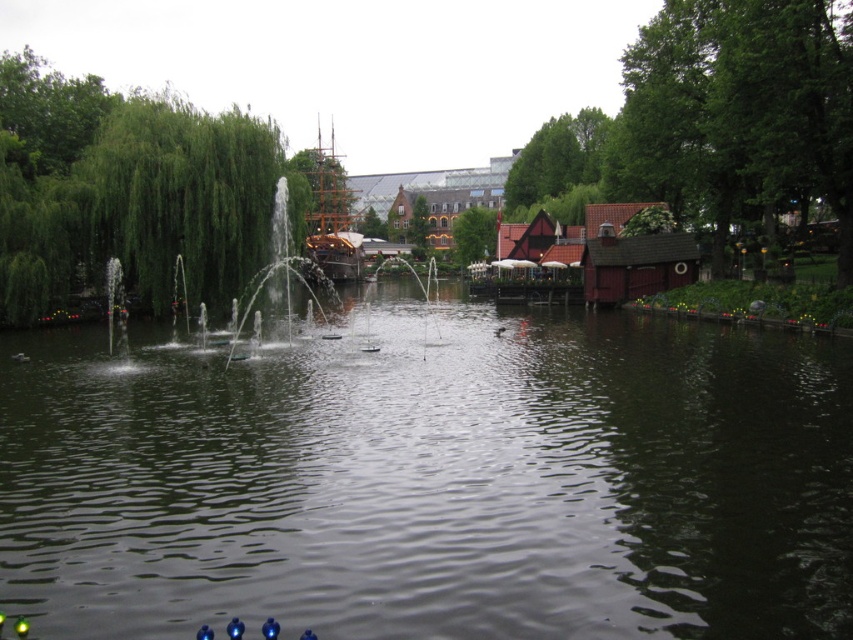
Which is below, green leafy tree at left or wooden ship at center?

green leafy tree at left is below.

Is point (167, 269) positioned before point (311, 150)?

Yes.

Image resolution: width=853 pixels, height=640 pixels. Describe the element at coordinates (131, 195) in the screenshot. I see `green leafy tree at left` at that location.

The image size is (853, 640). What are the coordinates of `green leafy tree at left` in the screenshot? It's located at (131, 195).

Which is behind, point (838, 220) or point (322, 211)?

Positioned behind is point (322, 211).

Who is more forward, (741, 177) or (316, 230)?

Point (741, 177) is in front.

Which is behind, point (747, 212) or point (335, 276)?

The point (335, 276) is more distant.

Locate an element on the screen. Image resolution: width=853 pixels, height=640 pixels. green wood tree at right is located at coordinates (718, 116).

Who is shorter, dark green water at center or wooden ship at center?

dark green water at center

Does dark green water at center have a greater width compared to wooden ship at center?

Indeed, dark green water at center has a greater width compared to wooden ship at center.

Is point (381, 573) closer to camera compared to point (323, 209)?

Yes, point (381, 573) is closer to viewer.

Locate an element on the screen. dark green water at center is located at coordinates (433, 481).